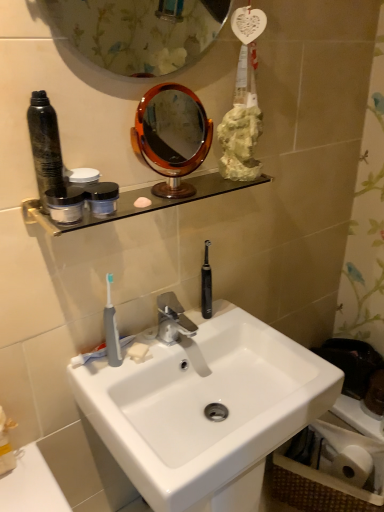
Question: From the image's perspective, relative to white matte soap at sink, is clear glass shelf at upper center above or below?

Choices:
 (A) above
 (B) below

Answer: (A)

Question: Looking at the image, does clear glass shelf at upper center seem bigger or smaller compared to white matte soap at sink?

Choices:
 (A) big
 (B) small

Answer: (A)

Question: Estimate the real-world distances between objects in this image. Which object is closer to the metallic black canister at left?

Choices:
 (A) white matte soap at sink
 (B) amber glass mirror at upper center
 (C) black rubber toothbrush at center, the 2th toothbrush when ordered from front to back
 (D) white matte toilet tissue paper at lower right
 (E) silver metallic faucet at center

Answer: (E)

Question: Which is farther from the black rubber toothbrush at center, the 2th toothbrush from the left?

Choices:
 (A) silver metallic faucet at center
 (B) matte black jar at upper center, which is the 2th coffee cup from left to right
 (C) white glossy sink at center
 (D) clear glass shelf at upper center
 (E) matte black jar at upper left, the 1th coffee cup positioned from the left

Answer: (E)